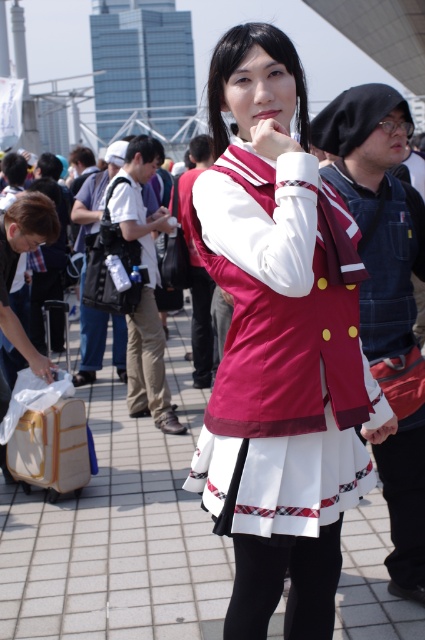
Does white fabric skirt at center have a greater width compared to wooden suitcase at lower left?

No, white fabric skirt at center is not wider than wooden suitcase at lower left.

Who is taller, white fabric skirt at center or wooden suitcase at lower left?

wooden suitcase at lower left

Who is more distant from viewer, (244, 637) or (56, 442)?

The point (56, 442) is behind.

You are a GUI agent. You are given a task and a screenshot of the screen. Output one action in this format:
    pyautogui.click(x=<x>, y=<y>)
    Task: Click on the white fabric skirt at center
    The width and height of the screenshot is (425, 640).
    Given the screenshot: What is the action you would take?
    pyautogui.click(x=282, y=586)

Is matte red vest at center closer to camera compared to white fabric skirt at center?

Yes, matte red vest at center is in front of white fabric skirt at center.

Does matte red vest at center have a larger size compared to white fabric skirt at center?

Yes, matte red vest at center is bigger than white fabric skirt at center.

Is point (235, 464) farther from camera compared to point (319, 614)?

No, (235, 464) is in front of (319, 614).

Image resolution: width=425 pixels, height=640 pixels. What are the coordinates of `matte red vest at center` in the screenshot? It's located at (280, 346).

Can you confirm if matte red vest at center is bigger than wooden suitcase at lower left?

Correct, matte red vest at center is larger in size than wooden suitcase at lower left.

Is matte red vest at center positioned behind wooden suitcase at lower left?

No, it is not.

Find the location of a particular element. Image resolution: width=425 pixels, height=640 pixels. matte red vest at center is located at coordinates (280, 346).

Locate an element on the screen. The height and width of the screenshot is (640, 425). matte red vest at center is located at coordinates (280, 346).